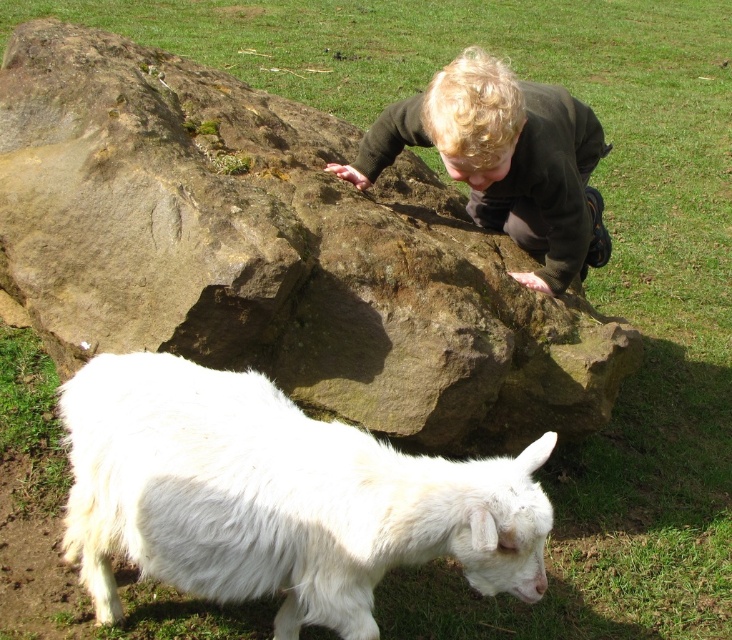
Question: Which point is farther to the camera?

Choices:
 (A) click(x=545, y=156)
 (B) click(x=436, y=509)
 (C) click(x=272, y=284)

Answer: (A)

Question: Where is brown rough rock at center located in relation to white fluffy goat at lower left in the image?

Choices:
 (A) right
 (B) left

Answer: (A)

Question: Which point is closer to the camera?

Choices:
 (A) (452, 442)
 (B) (418, 513)
 (C) (458, 108)

Answer: (B)

Question: Can you confirm if brown rough rock at center is bigger than dark brown sweater at upper center?

Choices:
 (A) no
 (B) yes

Answer: (B)

Question: Is brown rough rock at center to the left of white fluffy goat at lower left from the viewer's perspective?

Choices:
 (A) yes
 (B) no

Answer: (B)

Question: Which of the following is the farthest from the observer?

Choices:
 (A) 496,176
 (B) 324,301
 (C) 518,458

Answer: (A)